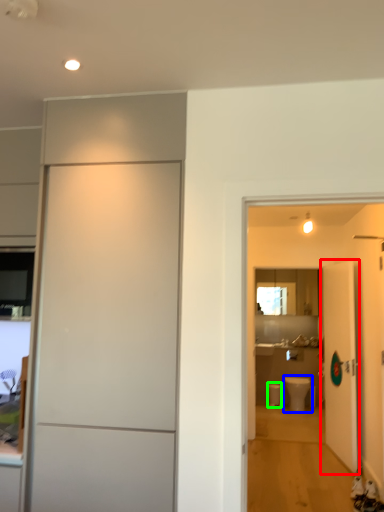
Question: Which object is the closest to the door (highlighted by a red box)? Choose among these: toilet (highlighted by a blue box) or toilet bowl (highlighted by a green box).

Choices:
 (A) toilet
 (B) toilet bowl

Answer: (A)